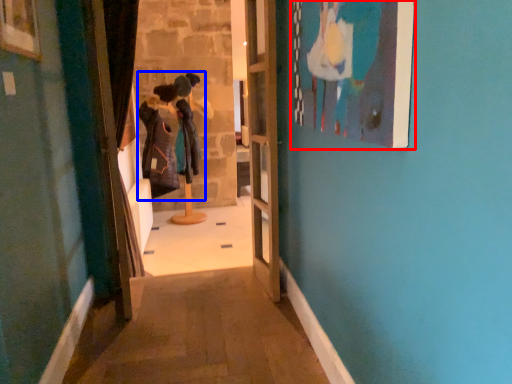
Question: Which of the following is the farthest to the observer, picture frame (highlighted by a red box) or couple (highlighted by a blue box)?

Choices:
 (A) picture frame
 (B) couple

Answer: (B)